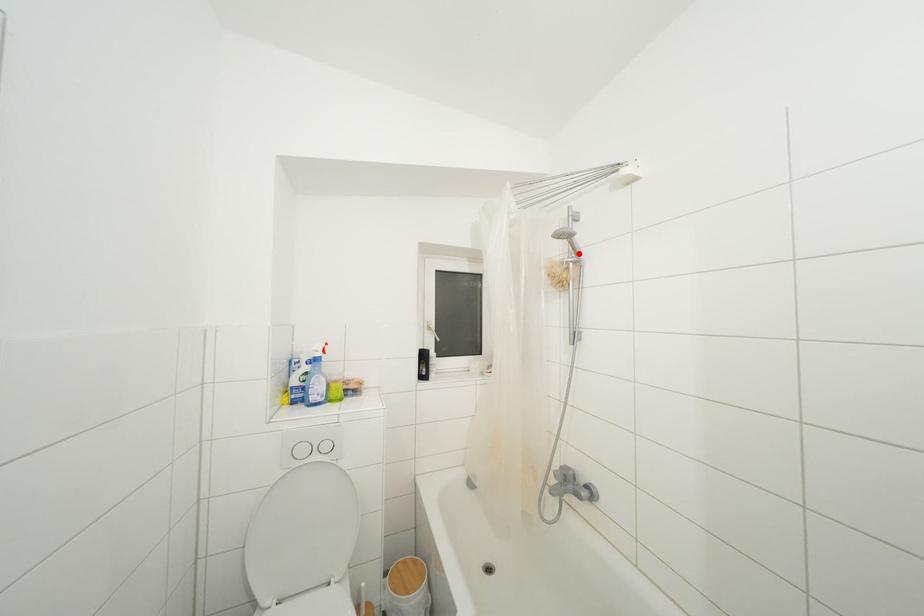
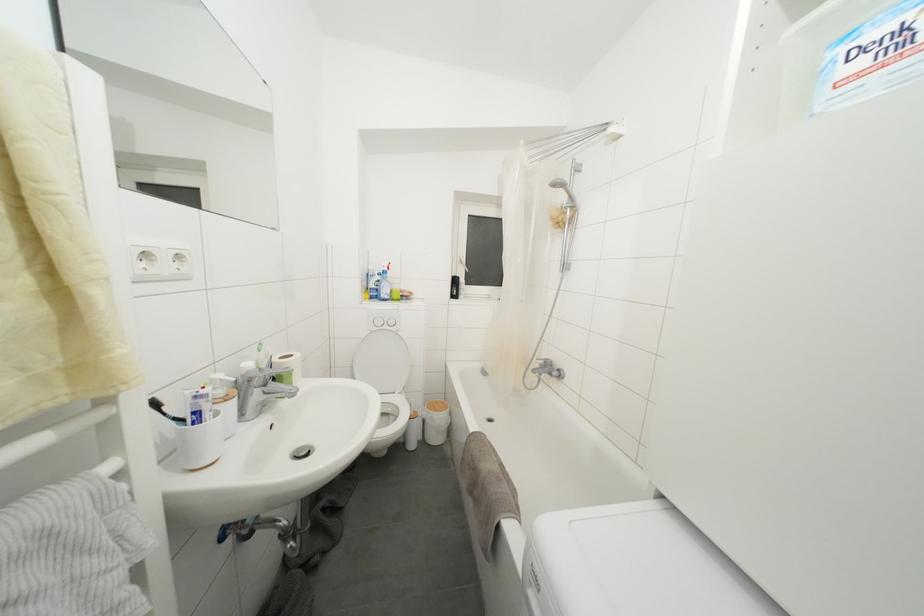
Where in the second image is the point corresponding to the highlighted location from the first image?

(575, 200)